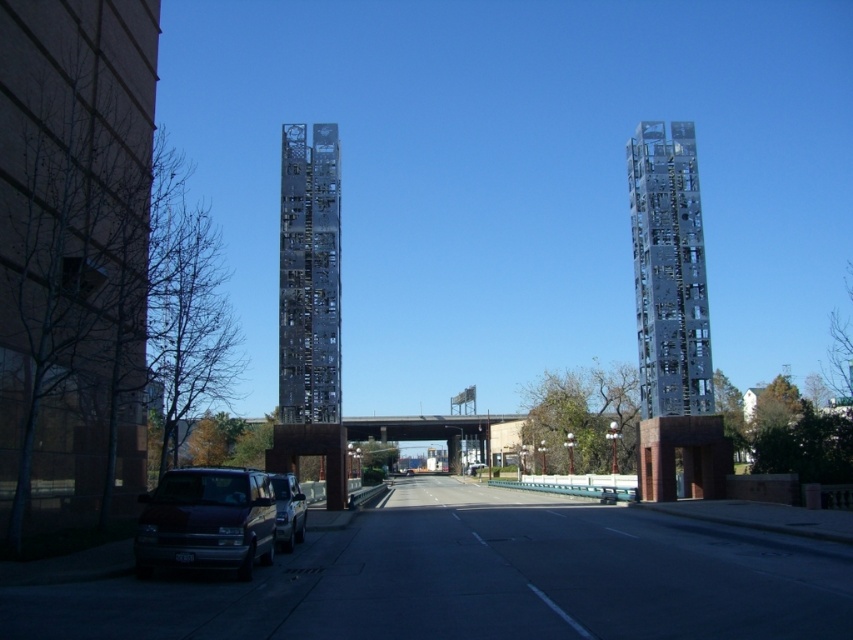
Question: In this image, where is metallic grid structure at center located relative to brown wooden bridge at center?

Choices:
 (A) below
 (B) above

Answer: (B)

Question: Which of these objects is positioned farthest from the brown wooden bridge at center?

Choices:
 (A) metallic silver suv at lower left
 (B) metallic grid structure at right

Answer: (A)

Question: Which point is farther to the camera?

Choices:
 (A) metallic grid structure at center
 (B) matte dark purple van at lower left
 (C) metallic silver suv at lower left

Answer: (A)

Question: Which of these objects is positioned farthest from the matte dark purple van at lower left?

Choices:
 (A) metallic silver suv at lower left
 (B) brown wooden bridge at center

Answer: (B)

Question: Can you confirm if metallic grid structure at right is bigger than metallic grid structure at center?

Choices:
 (A) yes
 (B) no

Answer: (A)

Question: Where is matte dark purple van at lower left located in relation to metallic silver suv at lower left in the image?

Choices:
 (A) right
 (B) left

Answer: (A)